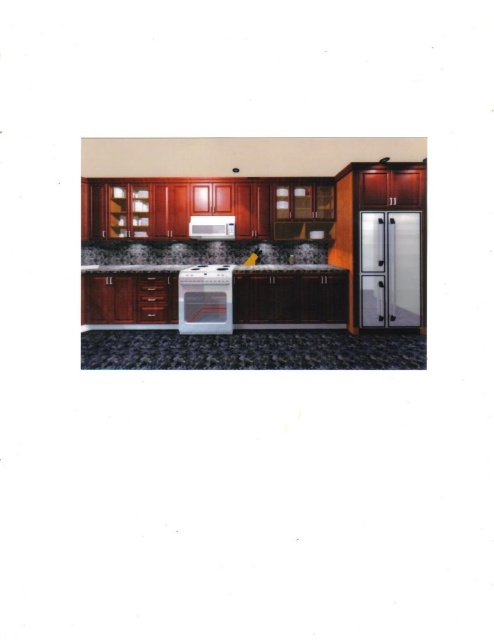
Question: Does granite countertop at center have a larger size compared to satin white microwave at center?

Choices:
 (A) yes
 (B) no

Answer: (A)

Question: Is satin stainless steel refrigerator at right closer to camera compared to satin white microwave at center?

Choices:
 (A) no
 (B) yes

Answer: (B)

Question: Which of the following is the farthest from the observer?

Choices:
 (A) granite countertop at center
 (B) satin stainless steel refrigerator at right
 (C) satin silver dishwasher at center
 (D) satin white microwave at center

Answer: (D)

Question: Which object appears farthest from the camera in this image?

Choices:
 (A) satin stainless steel refrigerator at right
 (B) satin silver dishwasher at center

Answer: (B)

Question: Which of the following is the farthest from the observer?

Choices:
 (A) satin white microwave at center
 (B) satin silver dishwasher at center
 (C) satin stainless steel refrigerator at right

Answer: (A)

Question: Does granite countertop at center have a lesser width compared to satin white microwave at center?

Choices:
 (A) no
 (B) yes

Answer: (A)